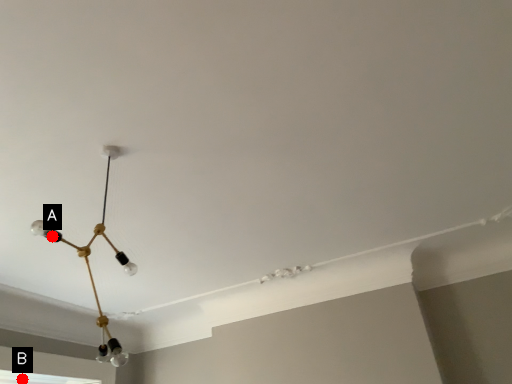
Question: Two points are circled on the image, labeled by A and B beside each circle. Which point is closer to the camera taking this photo?

Choices:
 (A) A is closer
 (B) B is closer

Answer: (A)